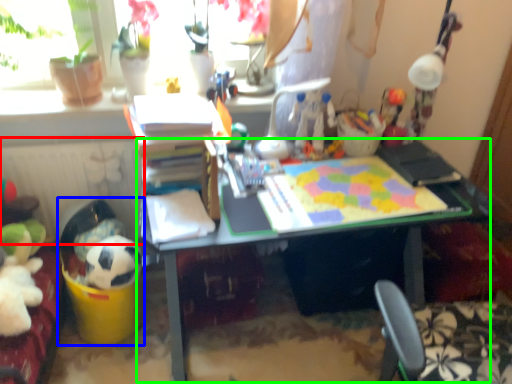
Question: Based on their relative distances, which object is farther from radiator (highlighted by a red box)? Choose from toy (highlighted by a blue box) and desk (highlighted by a green box).

Choices:
 (A) toy
 (B) desk

Answer: (B)